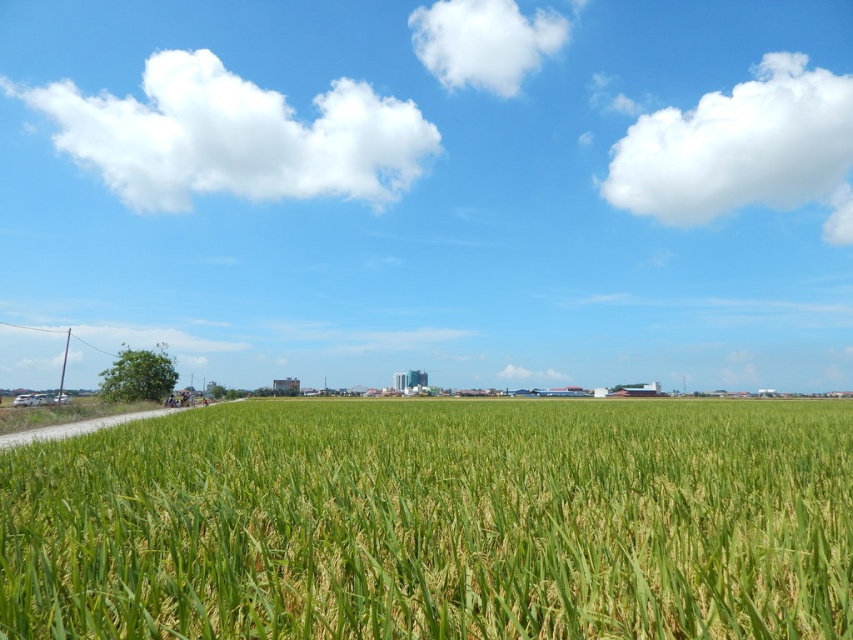
Question: Estimate the real-world distances between objects in this image. Which object is closer to the green grassy wheat field at center?

Choices:
 (A) white fluffy cloud at upper right
 (B) white fluffy cloud at upper center
 (C) white fluffy cloud at upper left

Answer: (C)

Question: From the image, what is the correct spatial relationship of green grassy wheat field at center in relation to white fluffy cloud at upper left?

Choices:
 (A) right
 (B) left

Answer: (A)

Question: In this image, where is green grassy wheat field at center located relative to white fluffy cloud at upper center?

Choices:
 (A) left
 (B) right

Answer: (A)

Question: Considering the real-world distances, which object is closest to the white fluffy cloud at upper center?

Choices:
 (A) green grassy wheat field at center
 (B) white fluffy cloud at upper left

Answer: (B)

Question: Can you confirm if green grassy wheat field at center is wider than white fluffy cloud at upper left?

Choices:
 (A) no
 (B) yes

Answer: (A)

Question: Which point is farther to the camera?

Choices:
 (A) white fluffy cloud at upper center
 (B) white fluffy cloud at upper right

Answer: (A)